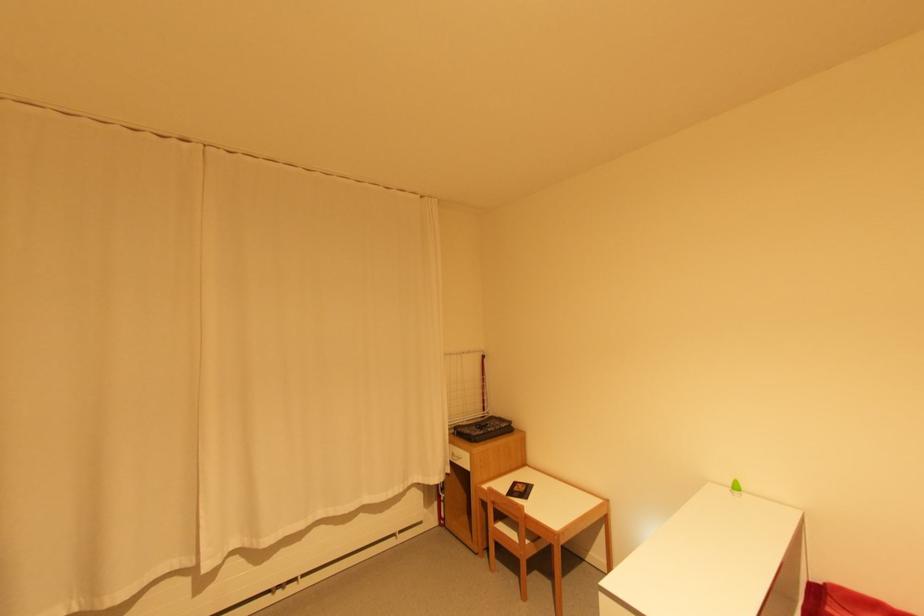
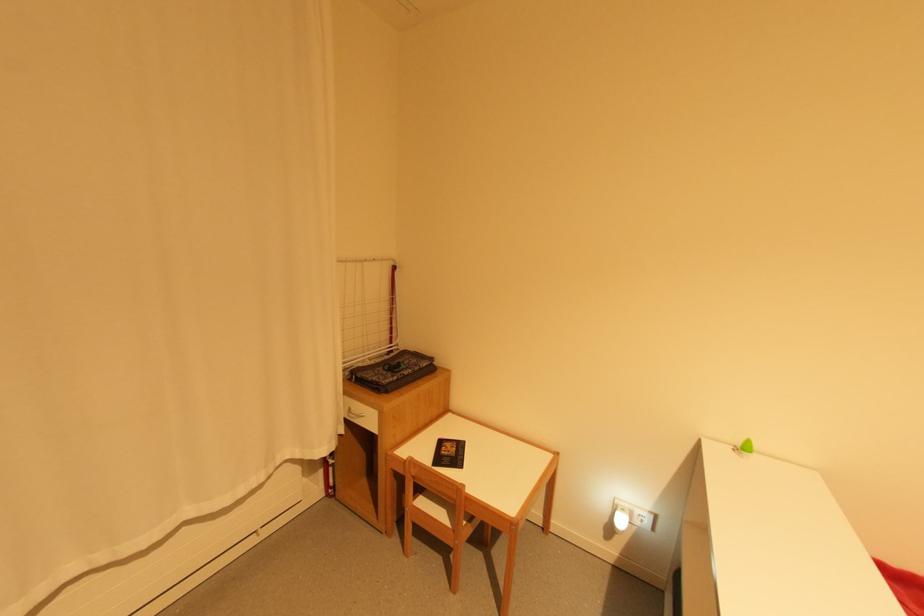
Question: How did the camera likely rotate?

Choices:
 (A) Left
 (B) Right
 (C) Up
 (D) Down

Answer: (B)